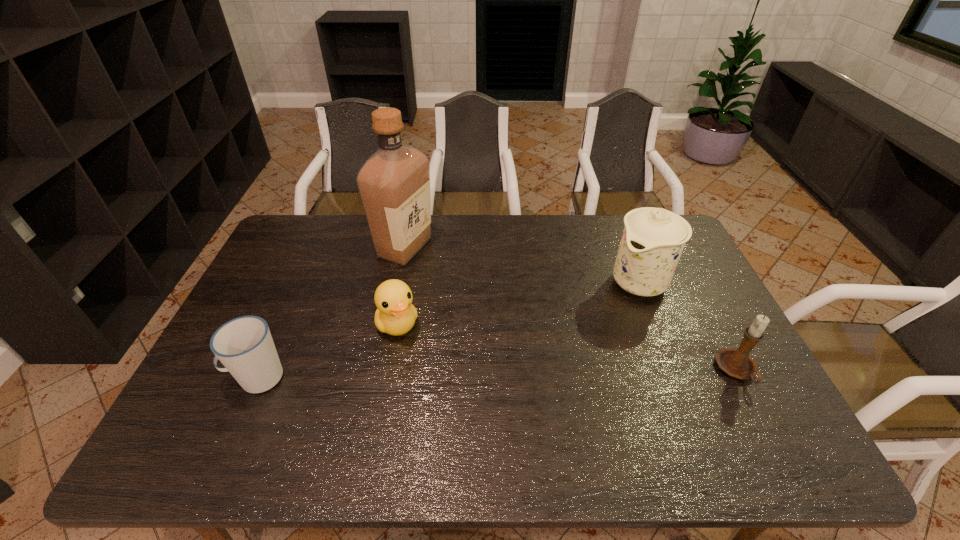
At what (x,y) coordinates should I click in order to perform the action: click on free spot that satisfies the following two spatial constraints: 1. on the back side of the chinaware; 2. on the left side of the third farthest object. Please return your answer as a coordinate pair (x, y). This screenshot has height=540, width=960. Looking at the image, I should click on (405, 282).